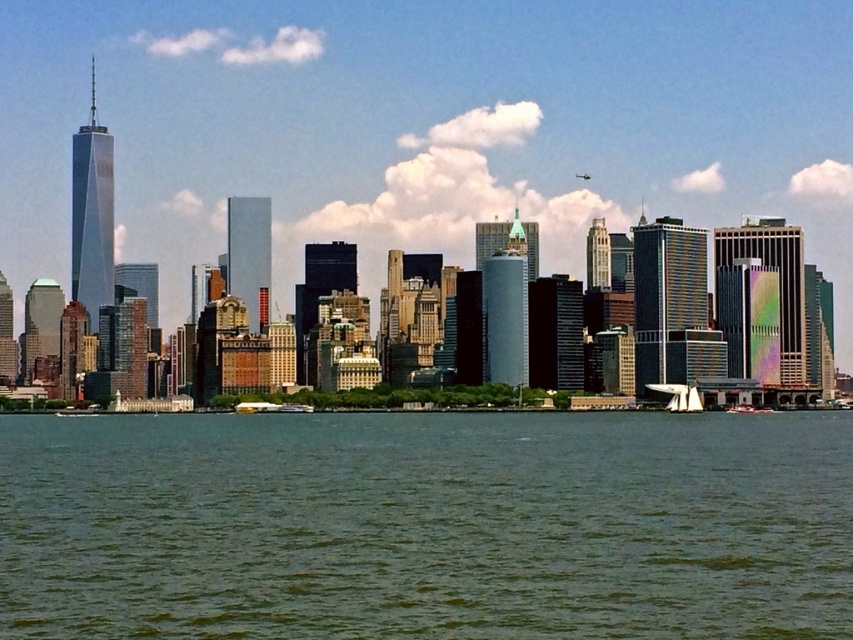
Which is behind, point (198, 602) or point (244, 406)?

The point (198, 602) is behind.

Is point (839, 618) farther from viewer compared to point (297, 404)?

Yes.

Locate an element on the screen. The width and height of the screenshot is (853, 640). green water at lower center is located at coordinates (426, 525).

At what (x,y) coordinates should I click in order to perform the action: click on yellow plastic boat at lower center. Please return your answer as a coordinate pair (x, y). The image size is (853, 640). Looking at the image, I should click on (271, 406).

Is point (244, 403) less distant than point (747, 404)?

Yes.

Between point (283, 403) and point (747, 410), which one is positioned in front?

Point (283, 403) is more forward.

You are a GUI agent. You are given a task and a screenshot of the screen. Output one action in this format:
    pyautogui.click(x=<x>, y=<y>)
    Task: Click on the yellow plastic boat at lower center
    
    Given the screenshot: What is the action you would take?
    pyautogui.click(x=271, y=406)

Find the location of a particular element. green water at lower center is located at coordinates 426,525.

Which is above, green water at lower center or white plastic sailboat at lower right?

white plastic sailboat at lower right is above.

This screenshot has height=640, width=853. What do you see at coordinates (426, 525) in the screenshot? I see `green water at lower center` at bounding box center [426, 525].

Where is `green water at lower center`? green water at lower center is located at coordinates (426, 525).